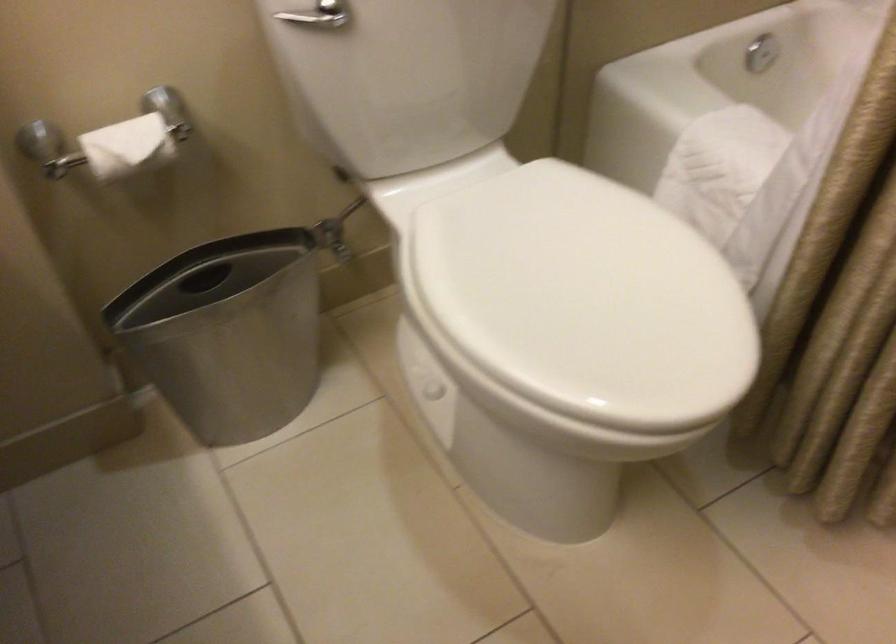
The height and width of the screenshot is (644, 896). What do you see at coordinates (126, 146) in the screenshot?
I see `a toilet paper roll` at bounding box center [126, 146].